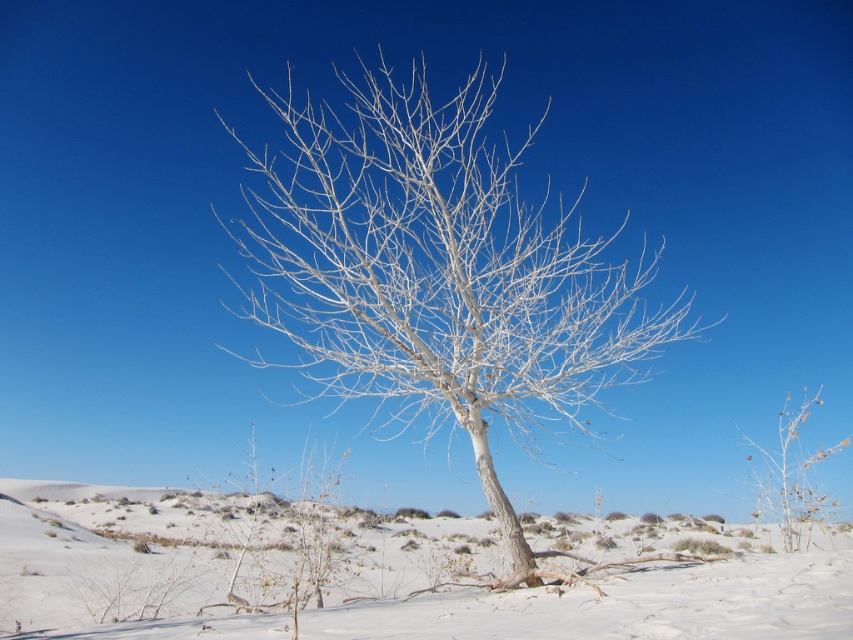
Question: Which object appears closest to the camera in this image?

Choices:
 (A) white powdery snow at center
 (B) white matte tree at center

Answer: (A)

Question: Among these objects, which one is farthest from the camera?

Choices:
 (A) white matte tree at center
 (B) white powdery snow at center

Answer: (A)

Question: Can you confirm if white matte tree at center is positioned to the right of white powdery snow at center?

Choices:
 (A) yes
 (B) no

Answer: (A)

Question: Which of the following is the farthest from the observer?

Choices:
 (A) white powdery snow at center
 (B) white matte tree at center

Answer: (B)

Question: Is white matte tree at center closer to the viewer compared to white powdery snow at center?

Choices:
 (A) yes
 (B) no

Answer: (B)

Question: Considering the relative positions of white matte tree at center and white powdery snow at center in the image provided, where is white matte tree at center located with respect to white powdery snow at center?

Choices:
 (A) above
 (B) below

Answer: (A)